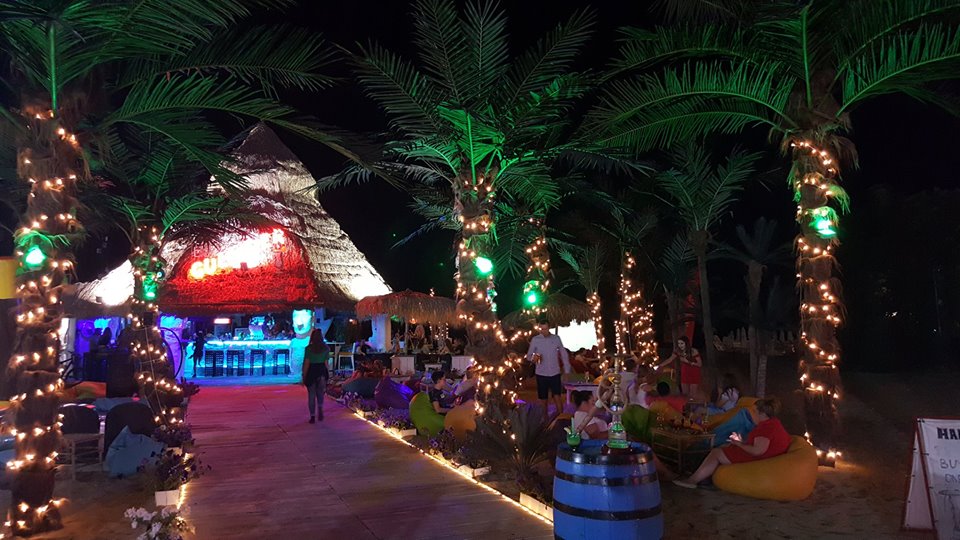
The image size is (960, 540). Find the location of `green lights`. green lights is located at coordinates (821, 221), (530, 295), (480, 261), (35, 251).